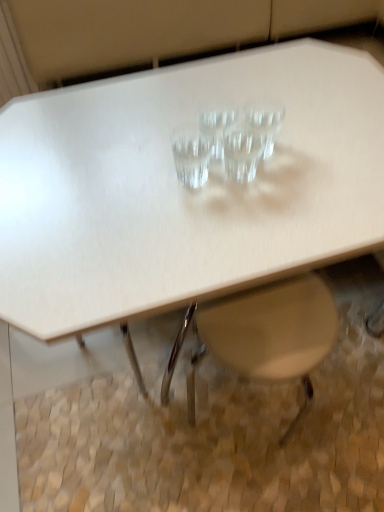
Where is `free space below white plastic swivel chair at lower center (from a real-world perspective)`? This screenshot has height=512, width=384. free space below white plastic swivel chair at lower center (from a real-world perspective) is located at coordinates (224, 443).